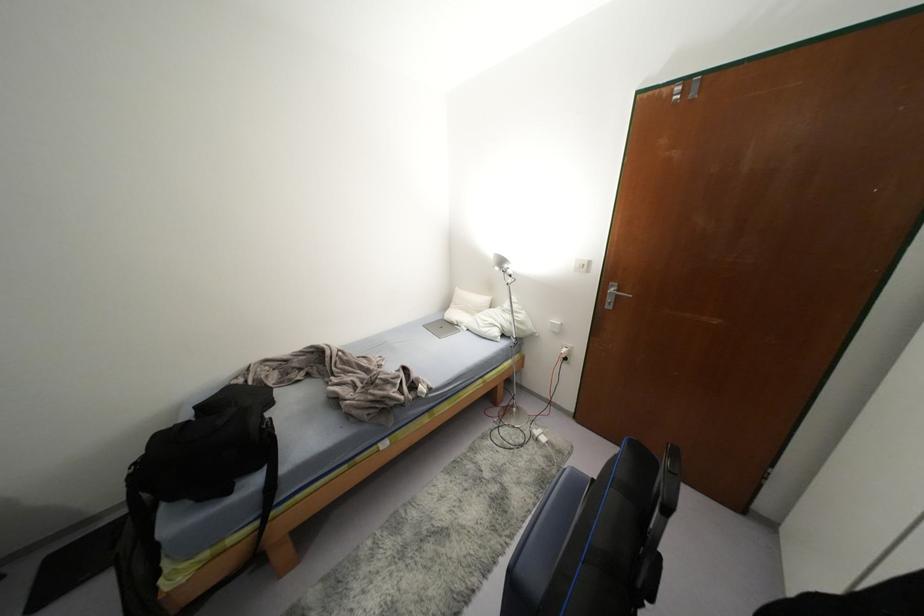
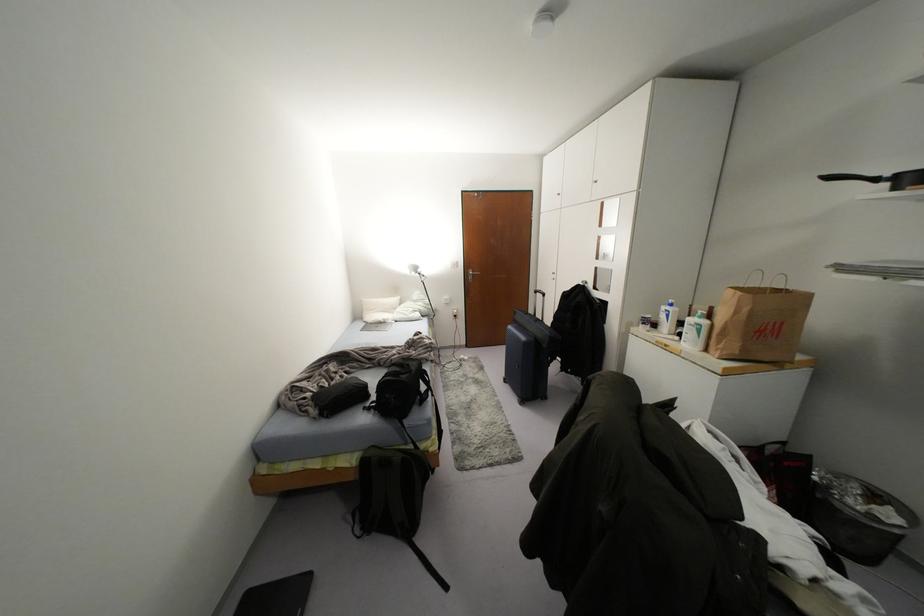
Locate, in the second image, the point that corresponds to (609,299) in the first image.

(469, 277)